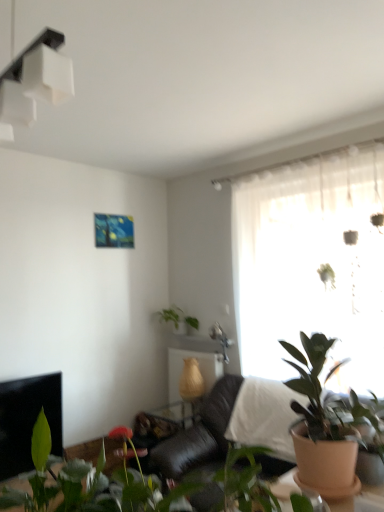
Question: Is point (56, 37) positioned closer to the camera than point (183, 312)?

Choices:
 (A) farther
 (B) closer

Answer: (B)

Question: Do you think white matte light fixture at upper left is within green matte plant at upper center, arranged as the 1th houseplant when viewed from the back, or outside of it?

Choices:
 (A) outside
 (B) inside

Answer: (A)

Question: Estimate the real-world distances between objects in this image. Which object is farther from the green matte plant at upper center, which appears as the third houseplant when viewed from the front?

Choices:
 (A) black leather couch at center
 (B) wooden at center
 (C) black glossy fireplace at lower left
 (D) white matte light fixture at upper left
 (E) green matte plant at right, which is the 2th houseplant in back-to-front order

Answer: (D)

Question: Estimate the real-world distances between objects in this image. Which object is farther from the translucent glass window at center?

Choices:
 (A) white glossy shelf at center
 (B) black glossy fireplace at lower left
 (C) green matte plant at upper center, arranged as the 1th houseplant when viewed from the back
 (D) green matte plant at right, positioned as the second houseplant in front-to-back order
 (E) wooden at center

Answer: (B)